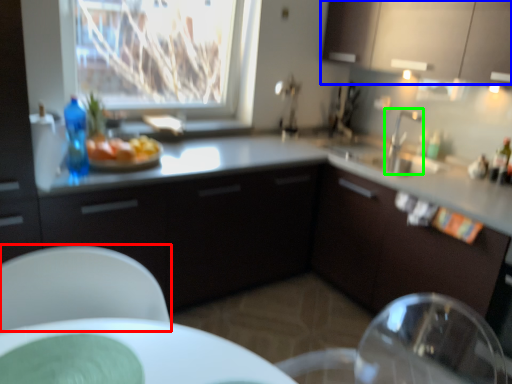
Question: Which object is the farthest from chair (highlighted by a red box)? Choose among these: cabinetry (highlighted by a blue box) or tap (highlighted by a green box).

Choices:
 (A) cabinetry
 (B) tap

Answer: (A)